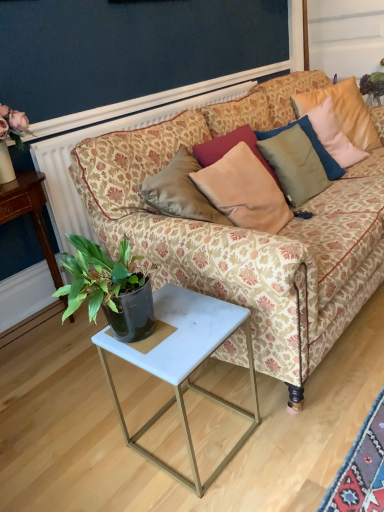
The height and width of the screenshot is (512, 384). Find the location of `free region under white marble table at lower left (from a real-world perspective)`. free region under white marble table at lower left (from a real-world perspective) is located at coordinates (33, 332).